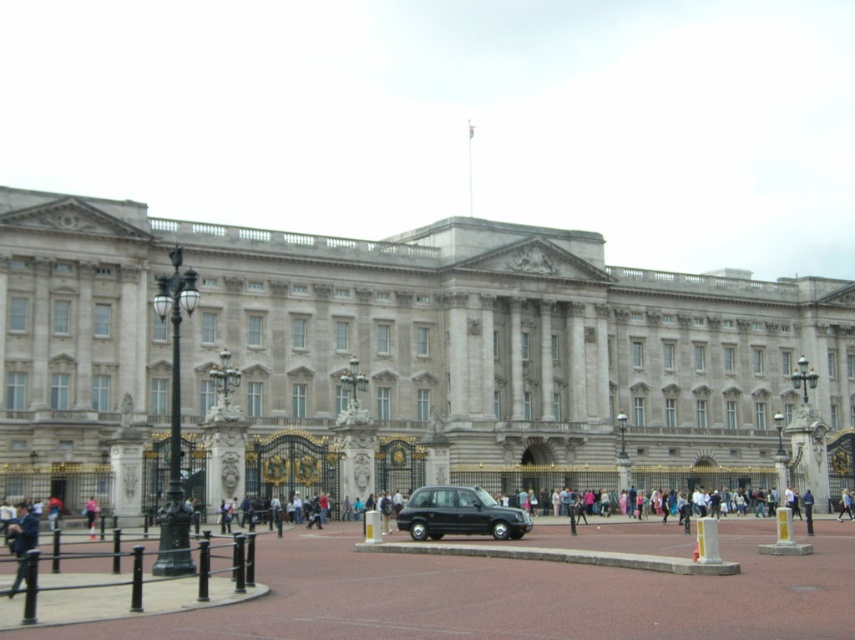
You are a tourist standing in front of Buckingham Palace and see the light blue fabric jacket at center and the pink fabric at center. Which item is closer to you?

The light blue fabric jacket at center is closer to you since the pink fabric at center is behind it.

You are standing in front of the grand historic building that looks like Buckingham Palace. You see a blue denim jacket at lower left and a light blue fabric jacket at center. If you want to pick up both jackets, which one do you need to walk towards first?

The blue denim jacket at lower left is closer to you than the light blue fabric jacket at center, so you should walk towards the blue denim jacket at lower left first.